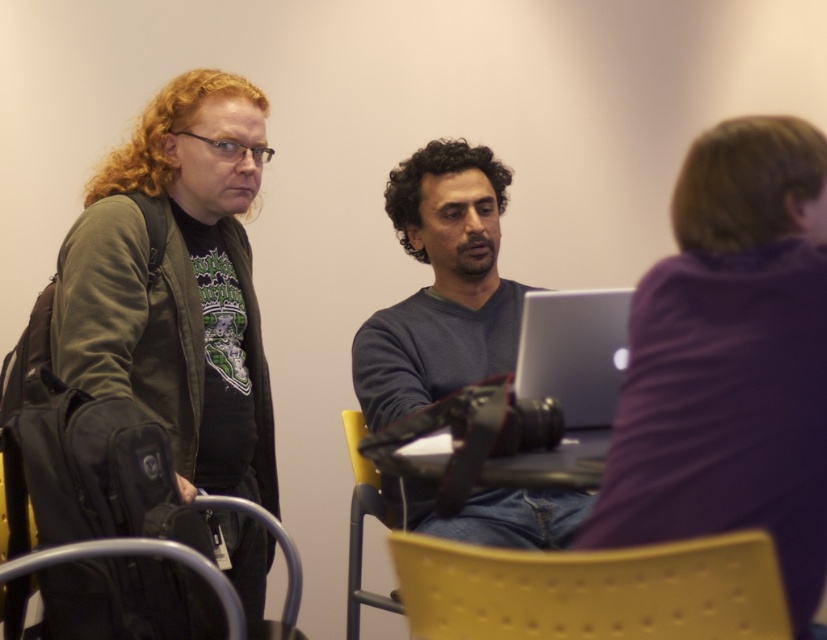
You are standing in the room and want to place a small plant on the floor between the matte black jacket at left and the yellow plastic chair at lower center. Is there enough space for the plant?

The matte black jacket at left is above the yellow plastic chair at lower center, meaning they are vertically aligned. Since the plant is to be placed on the floor between them, there should be sufficient horizontal space as they are positioned side by side horizontally.

You are trying to locate the matte black jacket at left in the scene. Where is it positioned relative to the yellow plastic chair at lower center?

The matte black jacket at left is positioned to the left of the yellow plastic chair at lower center.

You are a delivery person who needs to place a small package between the matte black jacket at left and the yellow plastic chair at center. The package is 50 centimeters long. Can you fit it between them?

The distance between the matte black jacket at left and the yellow plastic chair at center is 47.94 centimeters. Since the package is 50 centimeters long, it cannot be placed between them as the space is shorter than the package.